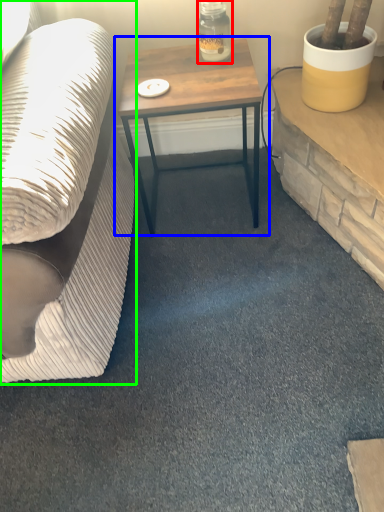
Question: Which is nearer to the bottle (highlighted by a red box)? table (highlighted by a blue box) or studio couch (highlighted by a green box).

Choices:
 (A) table
 (B) studio couch

Answer: (A)